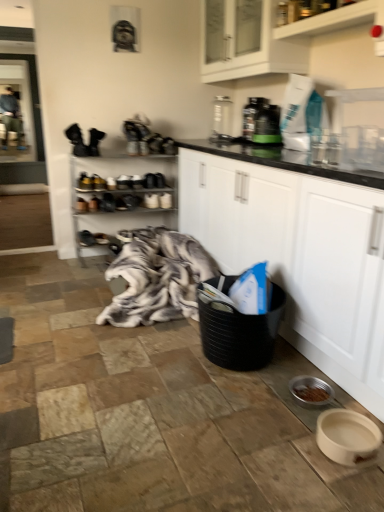
You are a GUI agent. You are given a task and a screenshot of the screen. Output one action in this format:
    pyautogui.click(x=<x>, y=<y>)
    Task: Click on the free region under green plastic bottle at upper center, marked as the 1th appliance in a right-to-left arrangement (from a real-world perspective)
    Image resolution: width=384 pixels, height=512 pixels.
    Given the screenshot: What is the action you would take?
    pyautogui.click(x=262, y=144)